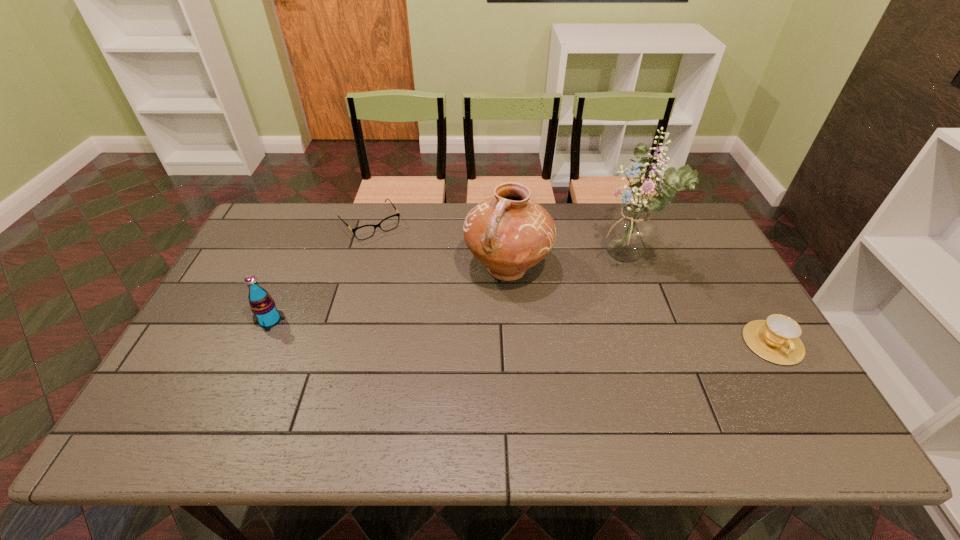
Locate an element on the screen. Image resolution: width=960 pixels, height=540 pixels. vacant space located on the right of the third tallest object is located at coordinates (401, 320).

The width and height of the screenshot is (960, 540). In order to click on vacant space located 0.100m with the handle on the side of the second shortest object in this screenshot , I will do `click(808, 402)`.

Find the location of a particular element. The width and height of the screenshot is (960, 540). vacant space situated 0.370m on the front-facing side of the bouquet is located at coordinates (497, 317).

Identify the location of vacant space located on the front-facing side of the bouquet. This screenshot has height=540, width=960. (564, 291).

Where is `free space located on the front-facing side of the bouquet`? The image size is (960, 540). free space located on the front-facing side of the bouquet is located at coordinates (535, 302).

Identify the location of vacant space located on the side of the second tallest object with the handle. This screenshot has width=960, height=540. 424,362.

Identify the location of free point located 0.170m on the side of the second tallest object with the handle. (450, 333).

Find the location of a particular element. Image resolution: width=960 pixels, height=540 pixels. blank area located 0.290m on the side of the second tallest object with the handle is located at coordinates (421, 364).

Where is `free spot located on the front-facing side of the fourth object from right to left`? free spot located on the front-facing side of the fourth object from right to left is located at coordinates click(x=421, y=289).

You are a GUI agent. You are given a task and a screenshot of the screen. Output one action in this format:
    pyautogui.click(x=<x>, y=<y>)
    Task: Click on the vacant space located on the front-facing side of the fourth object from right to left
    
    Given the screenshot: What is the action you would take?
    pyautogui.click(x=406, y=269)